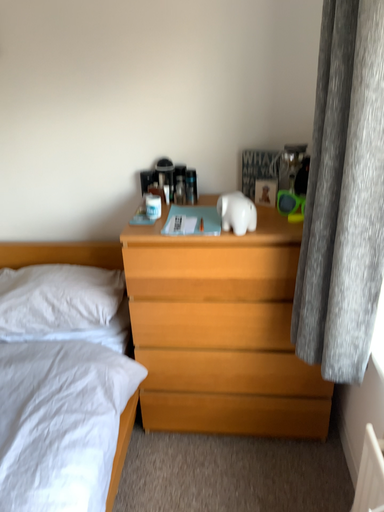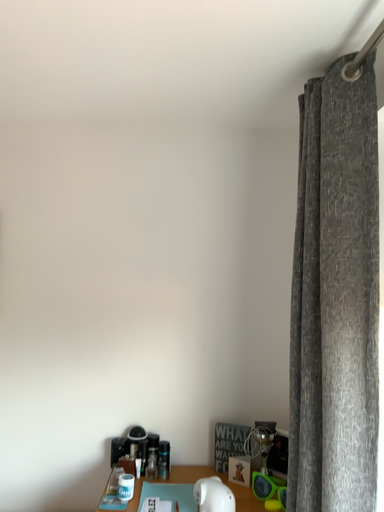
Question: How did the camera likely rotate when shooting the video?

Choices:
 (A) rotated upward
 (B) rotated downward

Answer: (A)